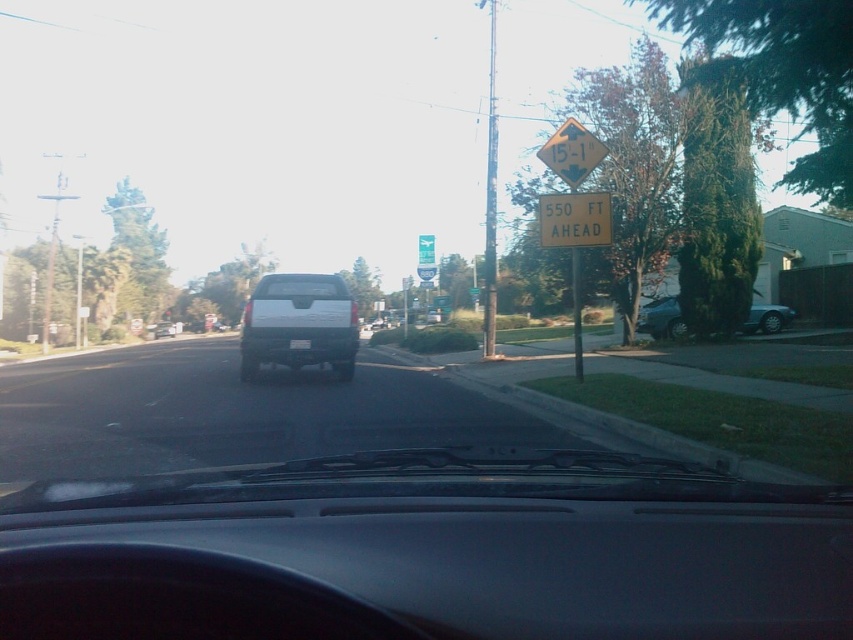
You are driving a matte black truck at center and need to pass under a low bridge 550 feet ahead. The yellow plastic sign at upper center shows the height limit. Based on the scene, can you determine if your truck will clear the height restriction?

The matte black truck at center has a greater height compared to the yellow plastic sign at upper center. Since the sign indicates a height restriction ahead, if the truck is taller than the allowed height indicated by the sign, it will not clear the restriction. However, without knowing the exact height limit from the sign, we cannot definitively determine if the truck will pass. The driver should check the truck height against the signposted limit.